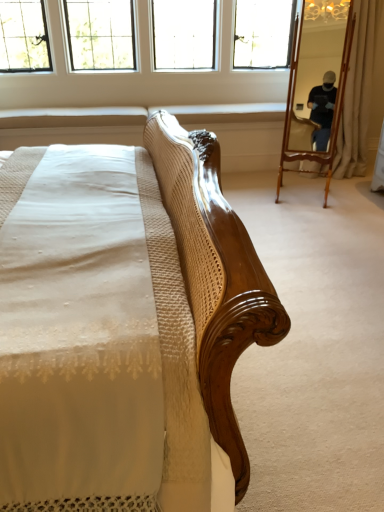
Question: From the image's perspective, relative to beige fabric curtain at right, is clear glass windows at upper center above or below?

Choices:
 (A) below
 (B) above

Answer: (B)

Question: In terms of height, does clear glass windows at upper center look taller or shorter compared to beige fabric curtain at right?

Choices:
 (A) tall
 (B) short

Answer: (B)

Question: Considering the real-world distances, which object is farthest from the beige fabric curtain at right?

Choices:
 (A) clear glass windows at upper center
 (B) wooden mirror at right

Answer: (A)

Question: Based on their relative distances, which object is farther from the beige fabric curtain at right?

Choices:
 (A) clear glass windows at upper center
 (B) wooden mirror at right

Answer: (A)